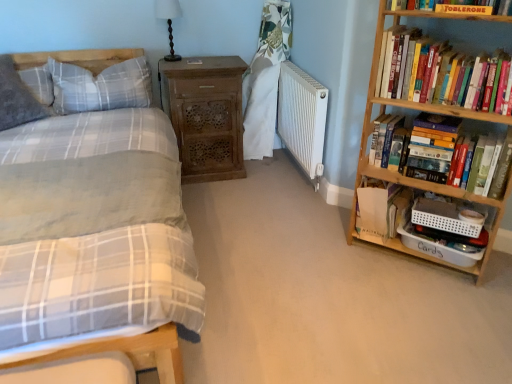
Identify the location of empty space that is ontop of white matte radiator at center (from a real-world perspective). (300, 74).